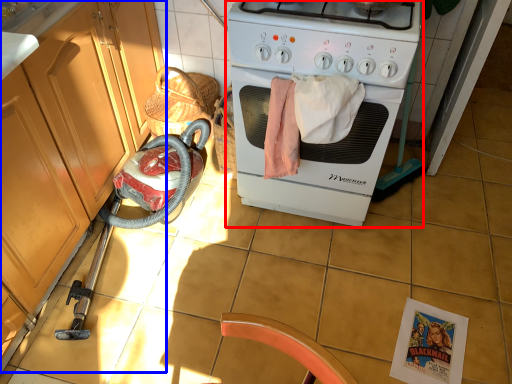
Question: Which of the following is the closest to the observer, home appliance (highlighted by a red box) or cabinetry (highlighted by a blue box)?

Choices:
 (A) home appliance
 (B) cabinetry

Answer: (B)